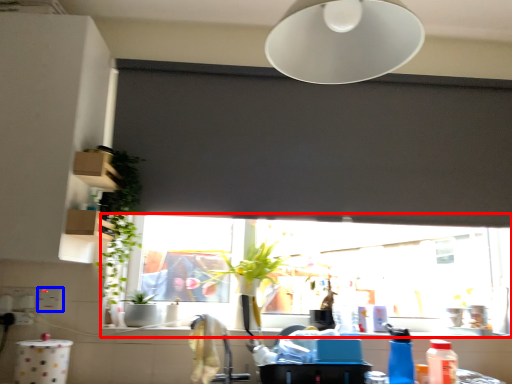
Question: Among these objects, which one is nearest to the camera, window (highlighted by a red box) or electric outlet (highlighted by a blue box)?

Choices:
 (A) window
 (B) electric outlet

Answer: (B)